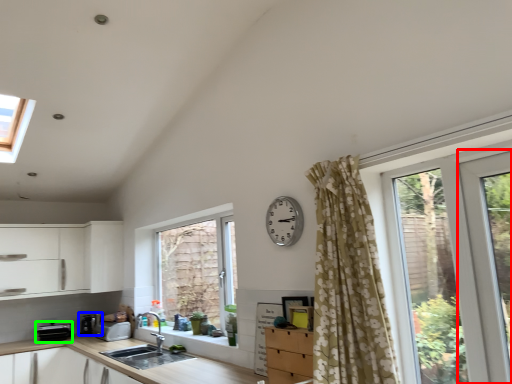
Question: Which object is positioned closest to screen door (highlighted by a red box)? Select from appliance (highlighted by a blue box) and appliance (highlighted by a green box).

Choices:
 (A) appliance
 (B) appliance

Answer: (A)